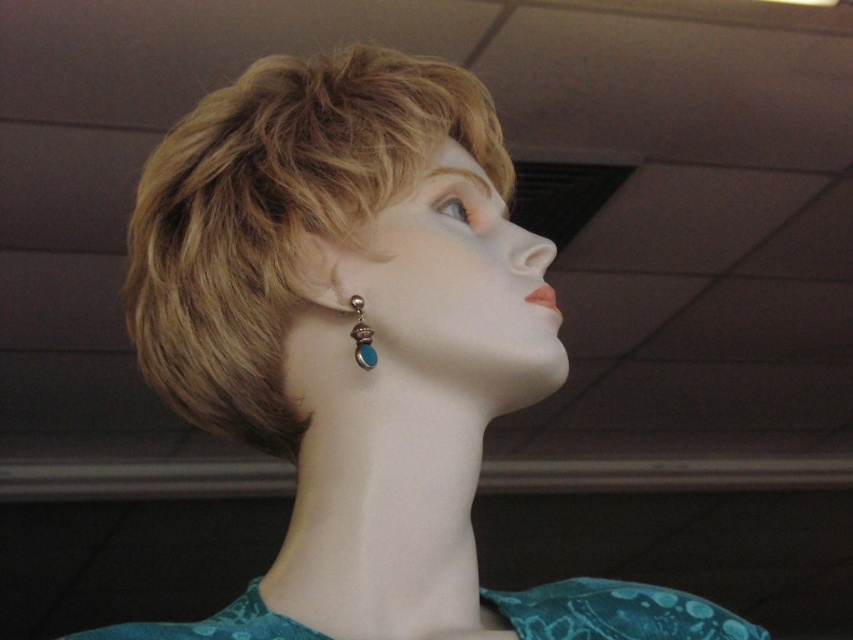
Question: Is blonde hair at upper center positioned before turquoise gemstone drop at lower left?

Choices:
 (A) yes
 (B) no

Answer: (B)

Question: Estimate the real-world distances between objects in this image. Which object is farther from the blonde hair at upper center?

Choices:
 (A) turquoise gemstone drop at lower left
 (B) teal fabric dress at lower center

Answer: (B)

Question: Which point appears farthest from the camera in this image?

Choices:
 (A) (247, 605)
 (B) (357, 60)
 (C) (355, 358)

Answer: (B)

Question: Among these points, which one is nearest to the camera?

Choices:
 (A) (375, 358)
 (B) (544, 612)

Answer: (A)

Question: In this image, where is blonde hair at upper center located relative to turquoise gemstone drop at lower left?

Choices:
 (A) above
 (B) below

Answer: (A)

Question: Observing the image, what is the correct spatial positioning of blonde hair at upper center in reference to teal fabric dress at lower center?

Choices:
 (A) right
 (B) left

Answer: (B)